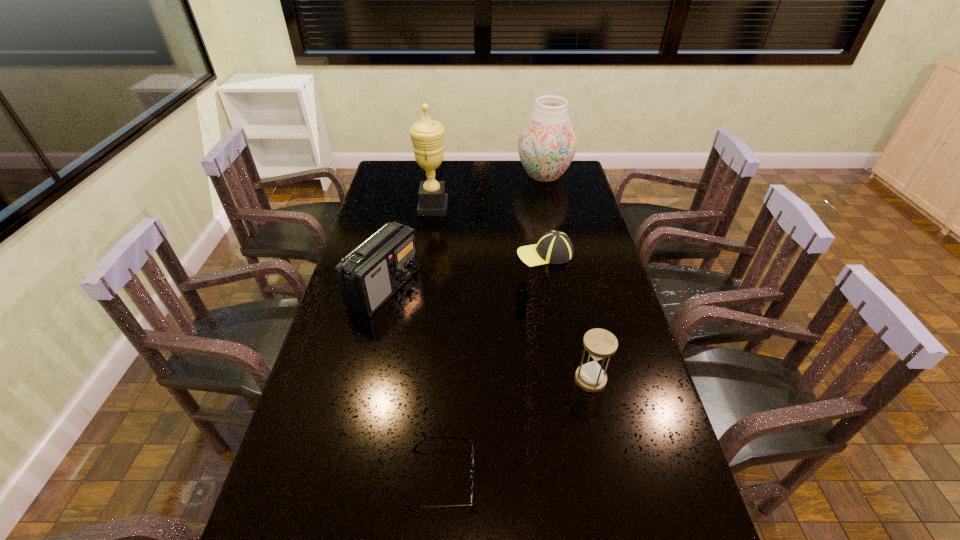
Where is `spectacles`? This screenshot has height=540, width=960. spectacles is located at coordinates (472, 447).

Where is `vacant space situated 0.400m at the front of the tallest object with handles`? The height and width of the screenshot is (540, 960). vacant space situated 0.400m at the front of the tallest object with handles is located at coordinates (545, 207).

You are a GUI agent. You are given a task and a screenshot of the screen. Output one action in this format:
    pyautogui.click(x=<x>, y=<y>)
    Task: Click on the vacant point located 0.340m on the left of the second tallest object
    
    Given the screenshot: What is the action you would take?
    pyautogui.click(x=442, y=176)

This screenshot has height=540, width=960. I want to click on vacant space situated on the front panel of the fifth shortest object, so click(435, 288).

Locate an element on the screen. This screenshot has height=540, width=960. free location located on the front of the hourglass is located at coordinates (623, 528).

At what (x,y) coordinates should I click in order to perform the action: click on vacant space located with the brim of the baseball cap facing forward. Please return your answer as a coordinate pair (x, y). The height and width of the screenshot is (540, 960). Looking at the image, I should click on (472, 254).

Where is `free region located 0.190m with the brim of the baseball cap facing forward`? The image size is (960, 540). free region located 0.190m with the brim of the baseball cap facing forward is located at coordinates (465, 254).

At what (x,y) coordinates should I click in order to perform the action: click on vacant space located with the brim of the baseball cap facing forward. Please return your answer as a coordinate pair (x, y). The image size is (960, 540). Looking at the image, I should click on (497, 254).

Locate an element on the screen. This screenshot has width=960, height=540. blank space located on the front-facing side of the Lego is located at coordinates (525, 343).

This screenshot has height=540, width=960. Find the location of `vacant space located on the front-facing side of the shortest object`. vacant space located on the front-facing side of the shortest object is located at coordinates tap(646, 477).